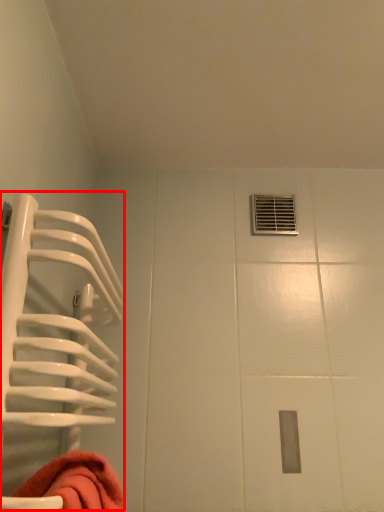
Question: Observing the image, what is the correct spatial positioning of cage (annotated by the red box) in reference to hole?

Choices:
 (A) left
 (B) right

Answer: (A)